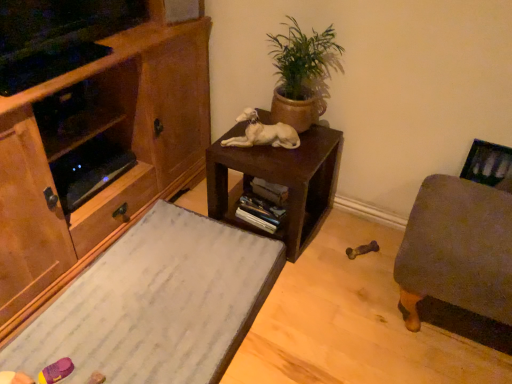
Question: Would you say wooden cabinet at left is to the left or to the right of green matte pot at upper center in the picture?

Choices:
 (A) left
 (B) right

Answer: (A)

Question: Looking at the image, does wooden cabinet at left seem bigger or smaller compared to green matte pot at upper center?

Choices:
 (A) big
 (B) small

Answer: (A)

Question: Estimate the real-world distances between objects in this image. Which object is closer to the brown matte table at center?

Choices:
 (A) wooden cabinet at left
 (B) white marble desk at lower left
 (C) green matte pot at upper center
 (D) white glossy statue at center

Answer: (D)

Question: Estimate the real-world distances between objects in this image. Which object is closer to the green matte pot at upper center?

Choices:
 (A) brown matte table at center
 (B) white glossy statue at center
 (C) white marble desk at lower left
 (D) wooden cabinet at left

Answer: (B)